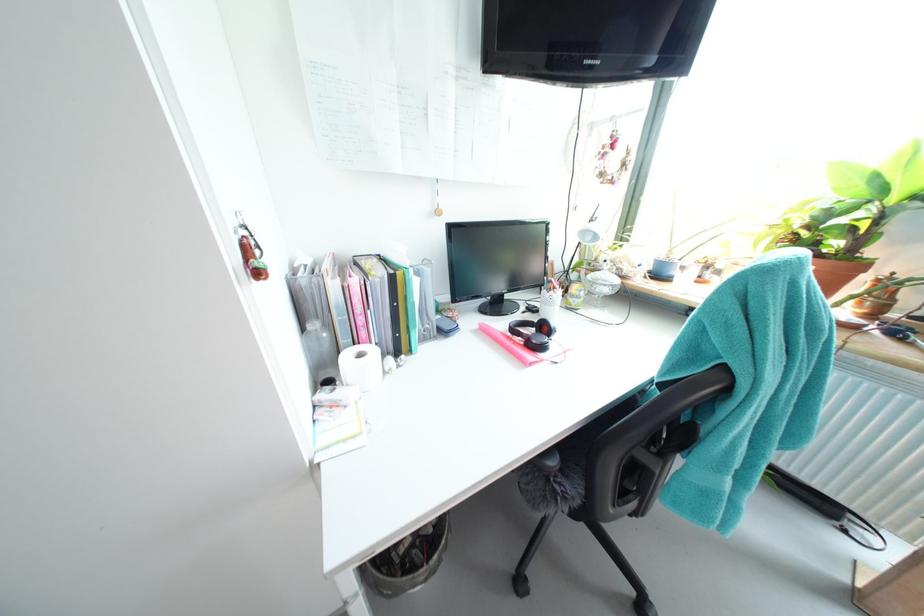
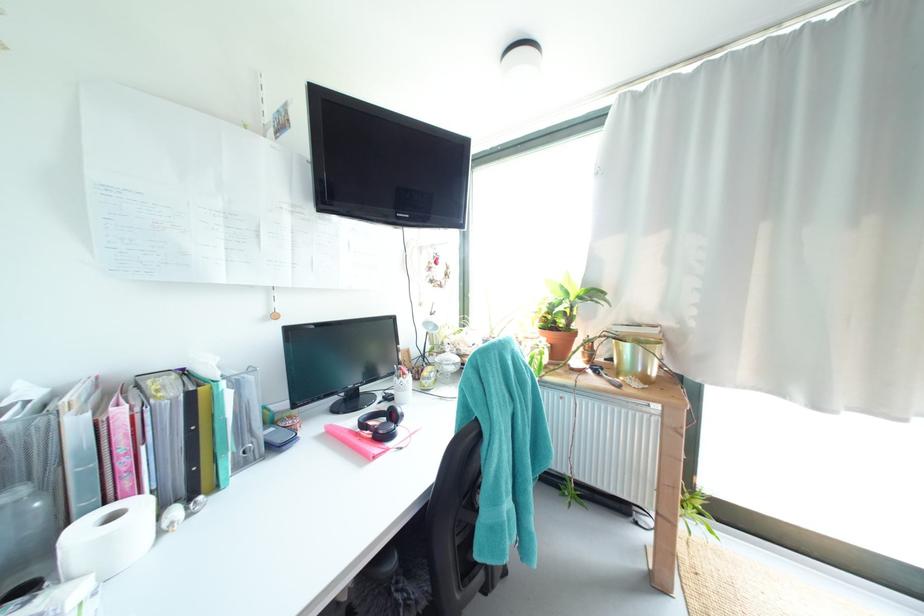
Where in the second image is the point corresponding to pixel 369 357 from the first image?

(120, 517)